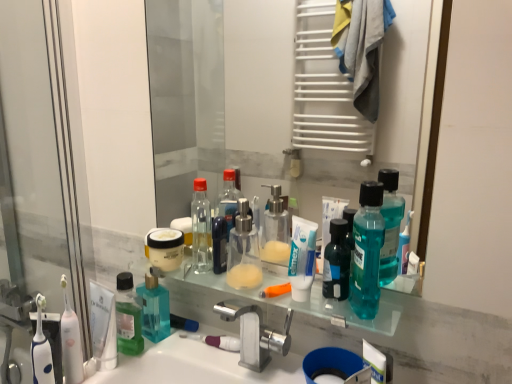
Locate an element on the screen. The image size is (512, 384). white glossy sink at lower center is located at coordinates (196, 366).

Find the location of a particular element. The image size is (512, 384). transparent plastic screen door at left is located at coordinates (38, 184).

Identify the location of silver metallic faucet at center. (255, 334).

Where is `transparent glass mirror at center`? The height and width of the screenshot is (384, 512). transparent glass mirror at center is located at coordinates (280, 99).

Between white glossy sink at lower center and transparent plastic screen door at left, which one has less height?

white glossy sink at lower center.

Considering the points (124, 376) and (17, 266), which point is in front, point (124, 376) or point (17, 266)?

The point (124, 376) is in front.

Looking at this image, is white glossy sink at lower center far away from transparent plastic screen door at left?

They are positioned close to each other.

Who is bigger, white glossy sink at lower center or transparent plastic screen door at left?

white glossy sink at lower center.

Considering the positions of objects teal plastic mouthwash at center and white glossy sink at lower center in the image provided, who is in front, teal plastic mouthwash at center or white glossy sink at lower center?

white glossy sink at lower center is closer to the camera.

Do you think teal plastic mouthwash at center is within white glossy sink at lower center, or outside of it?

teal plastic mouthwash at center lies outside white glossy sink at lower center.

Find the location of a particular element. sink below the teal plastic mouthwash at center (from the image's perspective) is located at coordinates (196, 366).

From the image's perspective, which one is positioned lower, teal plastic mouthwash at center or white glossy sink at lower center?

white glossy sink at lower center, from the image's perspective.

At what (x,y) coordinates should I click in order to perform the action: click on bottle in front of the silver metallic faucet at center. Please return your answer as a coordinate pair (x, y). The width and height of the screenshot is (512, 384). Looking at the image, I should click on (367, 251).

Does teal plastic mouthwash at center have a smaller size compared to silver metallic faucet at center?

Yes, teal plastic mouthwash at center is smaller than silver metallic faucet at center.

Between point (382, 240) and point (282, 350), which one is positioned in front?

Positioned in front is point (382, 240).

Is teal plastic mouthwash at center to the left of silver metallic faucet at center from the viewer's perspective?

No, teal plastic mouthwash at center is not to the left of silver metallic faucet at center.

Is white matte toothpaste at center looking in the opposite direction of transparent glass mirror at center?

Yes, white matte toothpaste at center is positioned with its back facing transparent glass mirror at center.

Who is bigger, white matte toothpaste at center or transparent glass mirror at center?

With larger size is transparent glass mirror at center.

Is white matte toothpaste at center far from transparent glass mirror at center?

Indeed, white matte toothpaste at center is not near transparent glass mirror at center.

Would you say white matte toothpaste at center is outside transparent glass mirror at center?

Yes.

Is transparent glass mirror at center inside the boundaries of silver metallic faucet at center, or outside?

transparent glass mirror at center is outside silver metallic faucet at center.

Considering the positions of objects transparent glass mirror at center and silver metallic faucet at center in the image provided, who is behind, transparent glass mirror at center or silver metallic faucet at center?

silver metallic faucet at center is further from the camera.

Is transparent glass mirror at center far from silver metallic faucet at center?

Yes.

Could you tell me if transparent glass mirror at center is facing silver metallic faucet at center?

No, transparent glass mirror at center is not facing towards silver metallic faucet at center.

Is transparent plastic screen door at left thinner than white glossy sink at lower center?

Correct, the width of transparent plastic screen door at left is less than that of white glossy sink at lower center.

From the picture: From the image's perspective, would you say transparent plastic screen door at left is positioned over white glossy sink at lower center?

Yes, from the image's perspective, transparent plastic screen door at left is above white glossy sink at lower center.

Consider the image. Who is shorter, transparent plastic screen door at left or white glossy sink at lower center?

With less height is white glossy sink at lower center.

The width and height of the screenshot is (512, 384). I want to click on screen door that is behind the white glossy sink at lower center, so click(x=38, y=184).

Considering the sizes of teal plastic mouthwash at center and transparent plastic screen door at left in the image, is teal plastic mouthwash at center taller or shorter than transparent plastic screen door at left?

Clearly, teal plastic mouthwash at center is shorter compared to transparent plastic screen door at left.

Does teal plastic mouthwash at center contain transparent plastic screen door at left?

No, transparent plastic screen door at left is not surrounded by teal plastic mouthwash at center.

Which is in front, point (378, 290) or point (16, 281)?

The point (378, 290) is more forward.

What are the coordinates of `sink located on the right of transparent plastic screen door at left` in the screenshot? It's located at (196, 366).

The image size is (512, 384). I want to click on sink in front of the teal plastic mouthwash at center, so click(196, 366).

Based on their spatial positions, is teal plastic mouthwash at center or white matte toothpaste at center further from silver metallic faucet at center?

teal plastic mouthwash at center is further to silver metallic faucet at center.

Considering their positions, is white glossy sink at lower center positioned further to silver metallic faucet at center than teal plastic mouthwash at center?

Among the two, teal plastic mouthwash at center is located further to silver metallic faucet at center.

Estimate the real-world distances between objects in this image. Which object is further from white glossy sink at lower center, silver metallic faucet at center or transparent glass mirror at center?

transparent glass mirror at center is positioned further to the anchor white glossy sink at lower center.

Looking at the image, which one is located further to transparent glass mirror at center, silver metallic faucet at center or teal plastic mouthwash at center?

silver metallic faucet at center is further to transparent glass mirror at center.

When comparing their distances from silver metallic faucet at center, does transparent glass mirror at center or white glossy sink at lower center seem closer?

white glossy sink at lower center.

Consider the image. Considering their positions, is transparent glass mirror at center positioned closer to white matte toothpaste at center than white glossy sink at lower center?

Among the two, white glossy sink at lower center is located nearer to white matte toothpaste at center.

In the scene shown: Estimate the real-world distances between objects in this image. Which object is closer to white glossy sink at lower center, white matte toothpaste at center or transparent plastic screen door at left?

Among the two, white matte toothpaste at center is located nearer to white glossy sink at lower center.

From the picture: Considering their positions, is white matte toothpaste at center positioned further to teal plastic mouthwash at center than white glossy sink at lower center?

white glossy sink at lower center.

The height and width of the screenshot is (384, 512). Find the location of `sink situated between transparent plastic screen door at left and silver metallic faucet at center from left to right`. sink situated between transparent plastic screen door at left and silver metallic faucet at center from left to right is located at coordinates [x=196, y=366].

Find the location of a particular element. The image size is (512, 384). mirror between transparent plastic screen door at left and teal plastic mouthwash at center is located at coordinates (280, 99).

What are the coordinates of `sink between transparent plastic screen door at left and white matte toothpaste at center in the horizontal direction` in the screenshot? It's located at (196, 366).

Locate an element on the screen. The width and height of the screenshot is (512, 384). tap situated between transparent plastic screen door at left and white matte toothpaste at center from left to right is located at coordinates (255, 334).